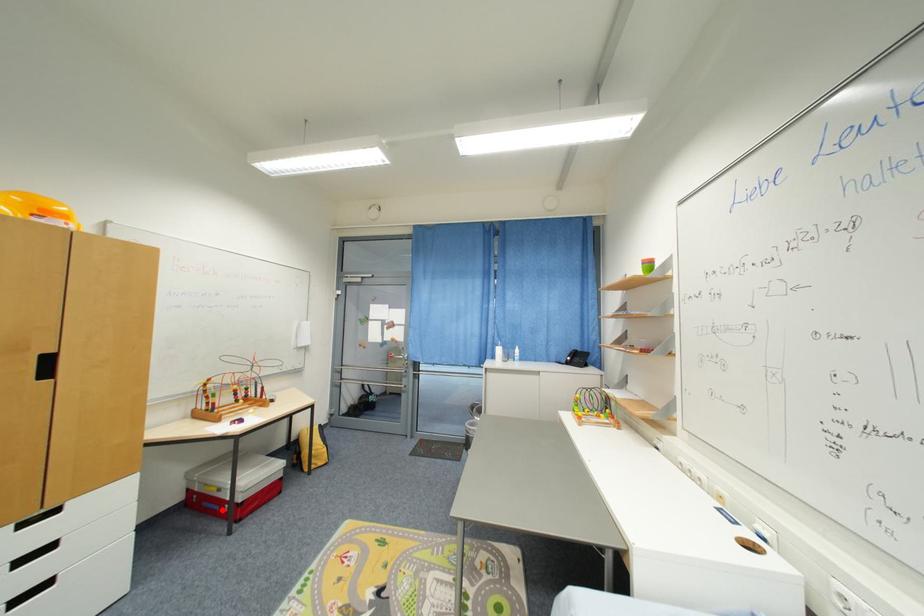
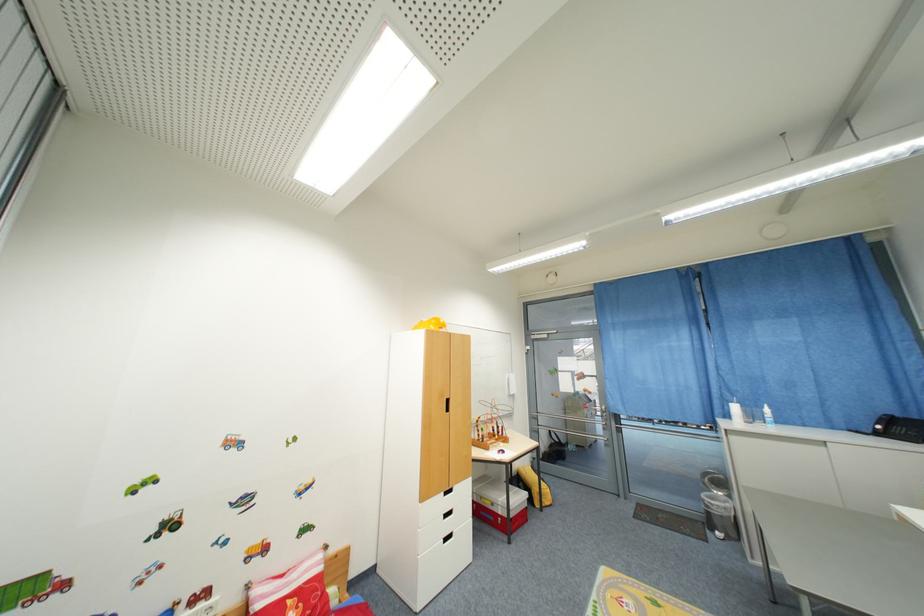
Question: I am providing you with two images of the same scene from different viewpoints. Given a red point in image1, look at the same physical point in image2. Is it:

Choices:
 (A) Closer to the viewpoint
 (B) Farther from the viewpoint

Answer: (B)